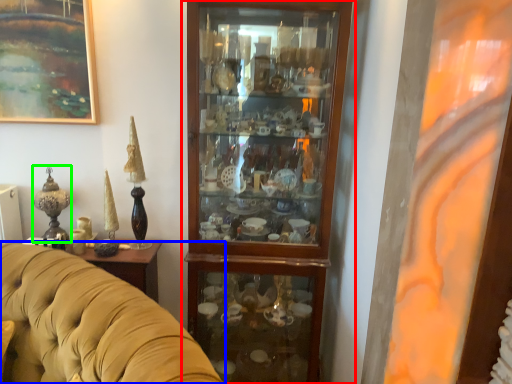
Question: Which object is the farthest from cupboard (highlighted by a red box)? Choose among these: studio couch (highlighted by a blue box) or candle holder (highlighted by a green box).

Choices:
 (A) studio couch
 (B) candle holder

Answer: (B)